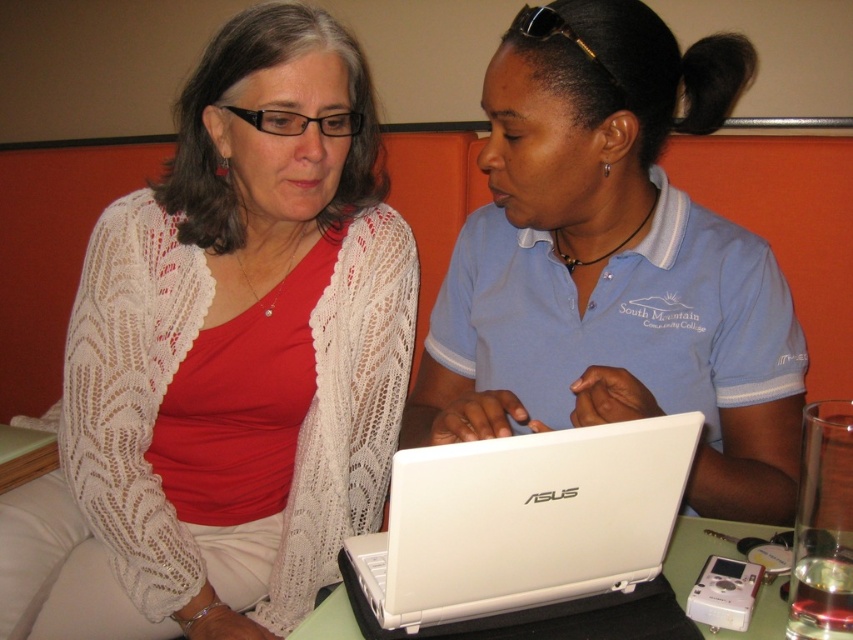
Question: Considering the real-world distances, which object is closest to the matte white laptop at center?

Choices:
 (A) white plastic laptop at center
 (B) matte white sweater at center
 (C) white lace cardigan at center
 (D) white matte laptop at center

Answer: (D)

Question: Is matte white sweater at center thinner than white lace cardigan at center?

Choices:
 (A) no
 (B) yes

Answer: (A)

Question: Does matte white sweater at center have a larger size compared to white plastic laptop at center?

Choices:
 (A) no
 (B) yes

Answer: (B)

Question: Does matte white sweater at center appear on the right side of white plastic laptop at center?

Choices:
 (A) no
 (B) yes

Answer: (A)

Question: Which of the following is the farthest from the observer?

Choices:
 (A) white matte laptop at center
 (B) matte white sweater at center

Answer: (B)

Question: Based on their relative distances, which object is nearer to the white matte laptop at center?

Choices:
 (A) white plastic laptop at center
 (B) matte white laptop at center
 (C) white lace cardigan at center
 (D) matte white sweater at center

Answer: (A)